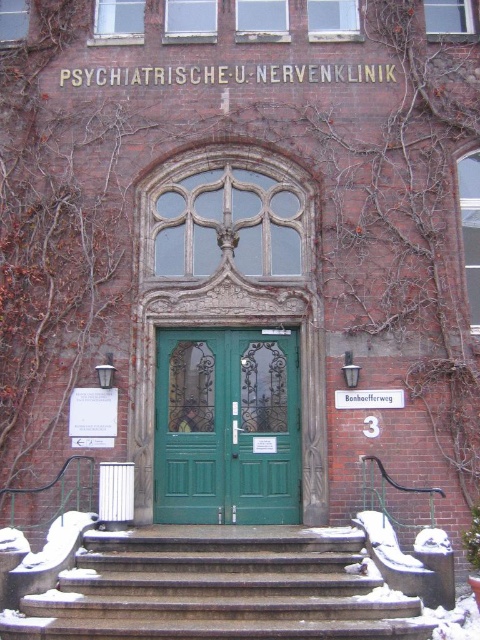
Is dark gray stone stairs at center smaller than green painted wood door at center?

No, dark gray stone stairs at center is not smaller than green painted wood door at center.

Does dark gray stone stairs at center appear on the left side of green painted wood door at center?

No, dark gray stone stairs at center is not to the left of green painted wood door at center.

Locate an element on the screen. Image resolution: width=480 pixels, height=640 pixels. dark gray stone stairs at center is located at coordinates (218, 588).

Where is `dark gray stone stairs at center`? This screenshot has width=480, height=640. dark gray stone stairs at center is located at coordinates (218, 588).

The width and height of the screenshot is (480, 640). What do you see at coordinates (192, 426) in the screenshot?
I see `green painted wood door at center` at bounding box center [192, 426].

Between green painted wood door at center and green matte door at center, which one appears on the right side from the viewer's perspective?

Positioned to the right is green matte door at center.

Describe the element at coordinates (192, 426) in the screenshot. I see `green painted wood door at center` at that location.

Where is `green painted wood door at center`? This screenshot has height=640, width=480. green painted wood door at center is located at coordinates (192, 426).

Is dark gray stone stairs at center to the right of green matte door at center from the viewer's perspective?

No, dark gray stone stairs at center is not to the right of green matte door at center.

Find the location of a particular element. This screenshot has width=480, height=640. dark gray stone stairs at center is located at coordinates (218, 588).

Locate an element on the screen. The width and height of the screenshot is (480, 640). dark gray stone stairs at center is located at coordinates (218, 588).